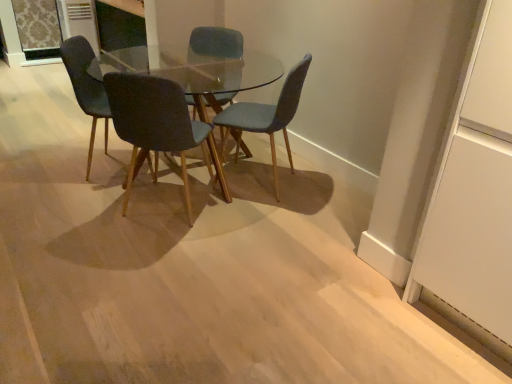
Locate an element on the screen. The height and width of the screenshot is (384, 512). vacant space to the left of matte blue chair at center, which is the first chair in left-to-right order is located at coordinates click(54, 164).